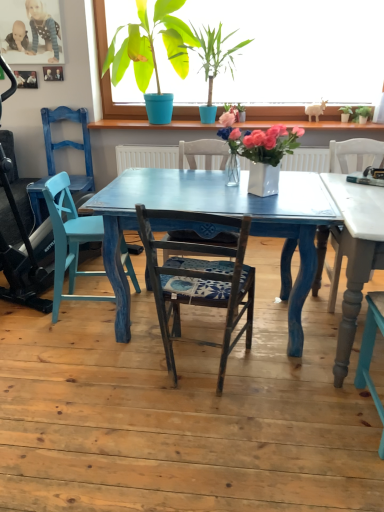
Question: Is matte blue chair at left located within green matte plant at upper center, the 5th houseplant from the right?

Choices:
 (A) yes
 (B) no

Answer: (B)

Question: Considering the relative sizes of green matte plant at upper center, placed as the first houseplant when sorted from left to right, and matte blue chair at left in the image provided, is green matte plant at upper center, placed as the first houseplant when sorted from left to right, shorter than matte blue chair at left?

Choices:
 (A) no
 (B) yes

Answer: (A)

Question: Could you tell me if green matte plant at upper center, placed as the first houseplant when sorted from left to right, is facing matte blue chair at left?

Choices:
 (A) no
 (B) yes

Answer: (A)

Question: From the image's perspective, would you say green matte plant at upper center, placed as the first houseplant when sorted from left to right, is positioned over matte blue chair at left?

Choices:
 (A) yes
 (B) no

Answer: (A)

Question: Is green matte plant at upper center, placed as the first houseplant when sorted from left to right, located outside matte blue chair at left?

Choices:
 (A) yes
 (B) no

Answer: (A)

Question: From a real-world perspective, is green matte plant at upper center, the 5th houseplant from the right, beneath matte blue chair at left?

Choices:
 (A) no
 (B) yes

Answer: (A)

Question: Does green matte plant at upper center, the second houseplant viewed from the left, have a lesser width compared to matte blue swivel chair at left?

Choices:
 (A) yes
 (B) no

Answer: (B)

Question: From a real-world perspective, is green matte plant at upper center, the second houseplant viewed from the left, physically below matte blue swivel chair at left?

Choices:
 (A) yes
 (B) no

Answer: (B)

Question: From a real-world perspective, is green matte plant at upper center, acting as the fourth houseplant starting from the right, located higher than matte blue swivel chair at left?

Choices:
 (A) yes
 (B) no

Answer: (A)

Question: Can you confirm if green matte plant at upper center, acting as the fourth houseplant starting from the right, is smaller than matte blue swivel chair at left?

Choices:
 (A) yes
 (B) no

Answer: (B)

Question: Is green matte plant at upper center, the second houseplant viewed from the left, surrounding matte blue swivel chair at left?

Choices:
 (A) yes
 (B) no

Answer: (B)

Question: Does green matte plant at upper center, acting as the fourth houseplant starting from the right, turn towards matte blue swivel chair at left?

Choices:
 (A) no
 (B) yes

Answer: (B)

Question: Is wooden chair with cushion at center in contact with green leafy plant at upper center, which is counted as the fifth houseplant, starting from the left?

Choices:
 (A) yes
 (B) no

Answer: (B)